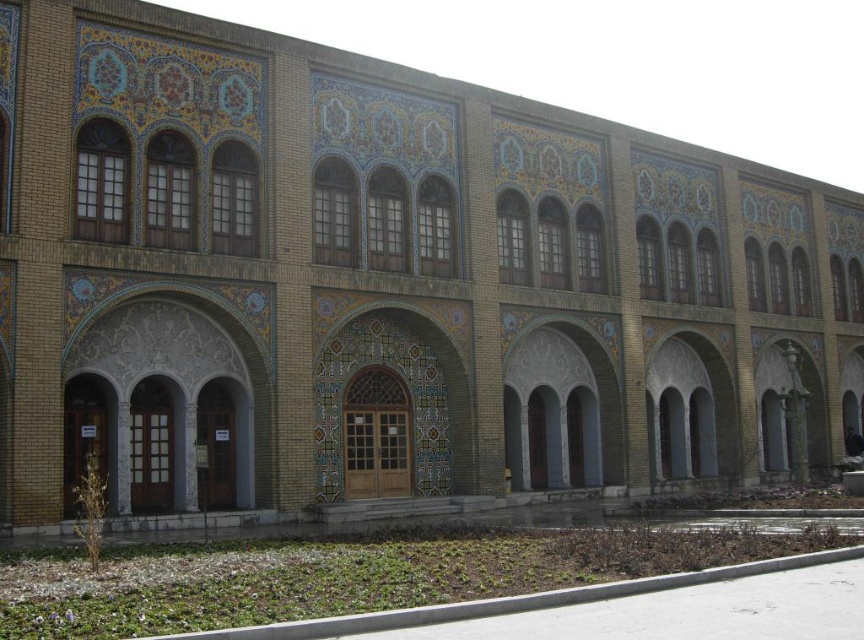
Question: Is white stone archway at center wider than gray stone archway at center?

Choices:
 (A) yes
 (B) no

Answer: (B)

Question: Based on their relative distances, which object is nearer to the white stone archway at center?

Choices:
 (A) matte stone archway at center
 (B) gray stone archway at center

Answer: (A)

Question: Which object is the farthest from the matte stone archway at center?

Choices:
 (A) white stone archway at center
 (B) gray stone archway at center

Answer: (A)

Question: Does white stone archway at center appear over matte stone archway at center?

Choices:
 (A) yes
 (B) no

Answer: (A)

Question: Among these points, which one is farthest from the camera?

Choices:
 (A) (715, 378)
 (B) (583, 397)

Answer: (A)

Question: Is white stone archway at center closer to camera compared to matte stone archway at center?

Choices:
 (A) no
 (B) yes

Answer: (B)